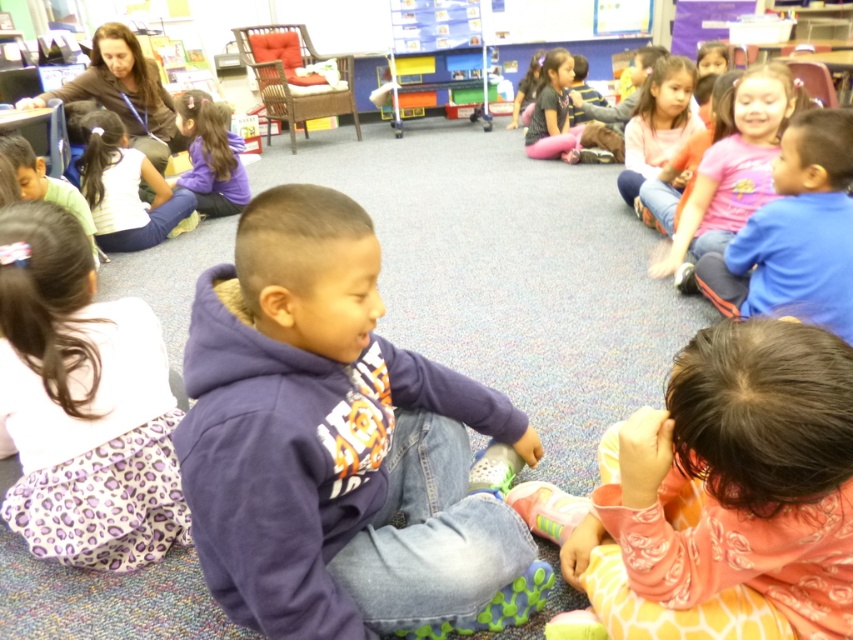
Question: Does purple fleece hoodie at center appear on the left side of pink cotton shirt at upper right?

Choices:
 (A) yes
 (B) no

Answer: (A)

Question: Does white cotton shirt at upper left appear under pink fleece sweater at upper right?

Choices:
 (A) no
 (B) yes

Answer: (B)

Question: Which object is closer to the camera taking this photo?

Choices:
 (A) dark brown leather jacket at upper left
 (B) matte purple shirt at center
 (C) purple leopard print skirt at lower left
 (D) white cotton shirt at upper left

Answer: (C)

Question: Is purple leopard print skirt at lower left to the left of pink matte shirt at upper right from the viewer's perspective?

Choices:
 (A) no
 (B) yes

Answer: (B)

Question: Which object is farther from the camera taking this photo?

Choices:
 (A) dark brown leather jacket at upper left
 (B) white cotton shirt at upper left

Answer: (A)

Question: Which object is positioned farthest from the purple leopard print skirt at lower left?

Choices:
 (A) white cotton shirt at upper left
 (B) purple fleece hoodie at center
 (C) pink fleece sweater at upper right
 (D) dark brown leather jacket at upper left

Answer: (D)